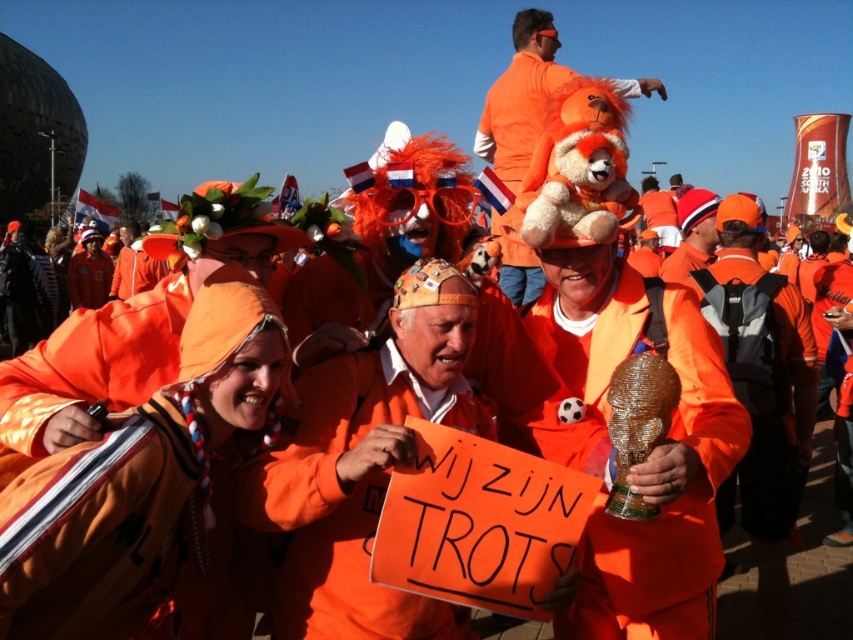
Question: Estimate the real-world distances between objects in this image. Which object is closer to the orange fabric backpack at center-right?

Choices:
 (A) orange matte hat at center
 (B) orange matte sign at center
 (C) matte orange jacket at center

Answer: (C)

Question: Is orange matte sign at center behind fluffy orange bear at center?

Choices:
 (A) no
 (B) yes

Answer: (A)

Question: Can you confirm if orange matte hat at center is thinner than orange fabric backpack at center-right?

Choices:
 (A) yes
 (B) no

Answer: (B)

Question: Which object appears farthest from the camera in this image?

Choices:
 (A) matte orange jacket at center
 (B) fluffy orange bear at center
 (C) orange fabric backpack at center-right
 (D) orange matte hat at center

Answer: (C)

Question: Which object is positioned farthest from the orange matte sign at center?

Choices:
 (A) orange matte hat at center
 (B) matte orange jacket at center
 (C) orange fabric backpack at center-right

Answer: (C)

Question: Can you confirm if orange matte sign at center is positioned above orange fabric backpack at center-right?

Choices:
 (A) no
 (B) yes

Answer: (A)